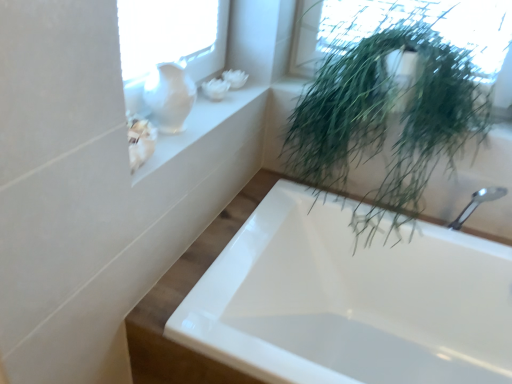
Where is `green leafy plant at upper right`? The image size is (512, 384). green leafy plant at upper right is located at coordinates (388, 111).

The width and height of the screenshot is (512, 384). Describe the element at coordinates (197, 126) in the screenshot. I see `white glossy vase at upper left` at that location.

What do you see at coordinates (350, 301) in the screenshot?
I see `white glossy bathtub at lower right` at bounding box center [350, 301].

From the picture: Measure the distance between white glossy bathtub at lower right and camera.

36.50 inches.

You are a GUI agent. You are given a task and a screenshot of the screen. Output one action in this format:
    pyautogui.click(x=<x>, y=<y>)
    Task: Click on the white glass vase at upper left
    This screenshot has width=512, height=384.
    Given the screenshot: What is the action you would take?
    pyautogui.click(x=170, y=95)

Locate an element on the screen. The height and width of the screenshot is (384, 512). glass vase above the white glossy vase at upper left (from a real-world perspective) is located at coordinates (170, 95).

In terms of width, does white glossy vase at upper left look wider or thinner when compared to white glass vase at upper left?

Considering their sizes, white glossy vase at upper left looks broader than white glass vase at upper left.

Could you tell me if white glossy vase at upper left is turned towards white glass vase at upper left?

No, white glossy vase at upper left is not facing towards white glass vase at upper left.

Is white glass vase at upper left touching white glossy bathtub at lower right?

No, white glass vase at upper left is not in contact with white glossy bathtub at lower right.

Is white glass vase at upper left positioned beyond the bounds of white glossy bathtub at lower right?

Yes, white glass vase at upper left is not within white glossy bathtub at lower right.

Considering the positions of objects white glass vase at upper left and white glossy bathtub at lower right in the image provided, who is more to the right, white glass vase at upper left or white glossy bathtub at lower right?

white glossy bathtub at lower right is more to the right.

From a real-world perspective, who is located higher, white glossy bathtub at lower right or green leafy plant at upper right?

In real-world perspective, green leafy plant at upper right is above.

Considering the positions of objects white glossy bathtub at lower right and green leafy plant at upper right in the image provided, who is more to the left, white glossy bathtub at lower right or green leafy plant at upper right?

From the viewer's perspective, white glossy bathtub at lower right appears more on the left side.

Is white glossy bathtub at lower right surrounding green leafy plant at upper right?

No.

Does point (173, 119) come behind point (185, 146)?

That is False.

How many degrees apart are the facing directions of white glass vase at upper left and white glossy vase at upper left?

0.339 degrees.

Is white glass vase at upper left facing towards white glossy vase at upper left?

No, white glass vase at upper left does not turn towards white glossy vase at upper left.

Is white glass vase at upper left completely or partially outside of white glossy vase at upper left?

Yes, white glass vase at upper left is located beyond the bounds of white glossy vase at upper left.

Which of these two, green leafy plant at upper right or white glossy bathtub at lower right, stands taller?

Standing taller between the two is green leafy plant at upper right.

From the image's perspective, is green leafy plant at upper right over white glossy bathtub at lower right?

Yes, from the image's perspective, green leafy plant at upper right is on top of white glossy bathtub at lower right.

Is green leafy plant at upper right positioned far away from white glossy bathtub at lower right?

That's not correct — green leafy plant at upper right is a little close to white glossy bathtub at lower right.

Is green leafy plant at upper right wider than white glossy bathtub at lower right?

Incorrect, the width of green leafy plant at upper right does not surpass that of white glossy bathtub at lower right.

Which of these two, green leafy plant at upper right or white glass vase at upper left, is wider?

green leafy plant at upper right.

From a real-world perspective, is green leafy plant at upper right physically located above or below white glass vase at upper left?

green leafy plant at upper right is below white glass vase at upper left.

Considering the positions of objects green leafy plant at upper right and white glass vase at upper left in the image provided, who is behind, green leafy plant at upper right or white glass vase at upper left?

white glass vase at upper left is further away from the camera.

In order to click on window sill above the white glossy bathtub at lower right (from the image's perspective) in this screenshot , I will do `click(197, 126)`.

Which object is more forward, white glossy bathtub at lower right or white glossy vase at upper left?

white glossy bathtub at lower right is more forward.

Is white glossy bathtub at lower right facing away from white glossy vase at upper left?

No.

Which is correct: white glossy bathtub at lower right is inside white glossy vase at upper left, or outside of it?

white glossy bathtub at lower right exists outside the volume of white glossy vase at upper left.

Locate an element on the screen. glass vase that appears behind the white glossy vase at upper left is located at coordinates (170, 95).

This screenshot has width=512, height=384. What are the coordinates of `bathtub beneath the white glass vase at upper left (from a real-world perspective)` in the screenshot? It's located at (350, 301).

Estimate the real-world distances between objects in this image. Which object is closer to white glossy vase at upper left, white glossy bathtub at lower right or green leafy plant at upper right?

Among the two, green leafy plant at upper right is located nearer to white glossy vase at upper left.

Based on their spatial positions, is white glass vase at upper left or white glossy bathtub at lower right closer to green leafy plant at upper right?

white glossy bathtub at lower right.

Estimate the real-world distances between objects in this image. Which object is further from white glossy vase at upper left, green leafy plant at upper right or white glass vase at upper left?

green leafy plant at upper right is positioned further to the anchor white glossy vase at upper left.

Looking at the image, which one is located further to green leafy plant at upper right, white glossy vase at upper left or white glass vase at upper left?

Result: Based on the image, white glass vase at upper left appears to be further to green leafy plant at upper right.

Based on their spatial positions, is white glossy bathtub at lower right or white glass vase at upper left closer to green leafy plant at upper right?

white glossy bathtub at lower right lies closer to green leafy plant at upper right than the other object.

Based on their spatial positions, is white glossy bathtub at lower right or white glossy vase at upper left further from white glass vase at upper left?

The object further to white glass vase at upper left is white glossy bathtub at lower right.

Based on their spatial positions, is green leafy plant at upper right or white glass vase at upper left closer to white glossy bathtub at lower right?

green leafy plant at upper right.

Considering their positions, is white glossy bathtub at lower right positioned closer to white glossy vase at upper left than white glass vase at upper left?

Based on the image, white glass vase at upper left appears to be nearer to white glossy vase at upper left.

Find the location of a particular element. This screenshot has width=512, height=384. window sill between green leafy plant at upper right and white glossy bathtub at lower right from top to bottom is located at coordinates (197, 126).

I want to click on houseplant between white glass vase at upper left and white glossy bathtub at lower right vertically, so click(x=388, y=111).

At what (x,y) coordinates should I click in order to perform the action: click on window sill between white glass vase at upper left and white glossy bathtub at lower right vertically. Please return your answer as a coordinate pair (x, y). The image size is (512, 384). Looking at the image, I should click on click(197, 126).

Locate an element on the screen. Image resolution: width=512 pixels, height=384 pixels. window sill located between white glass vase at upper left and green leafy plant at upper right in the left-right direction is located at coordinates [197, 126].